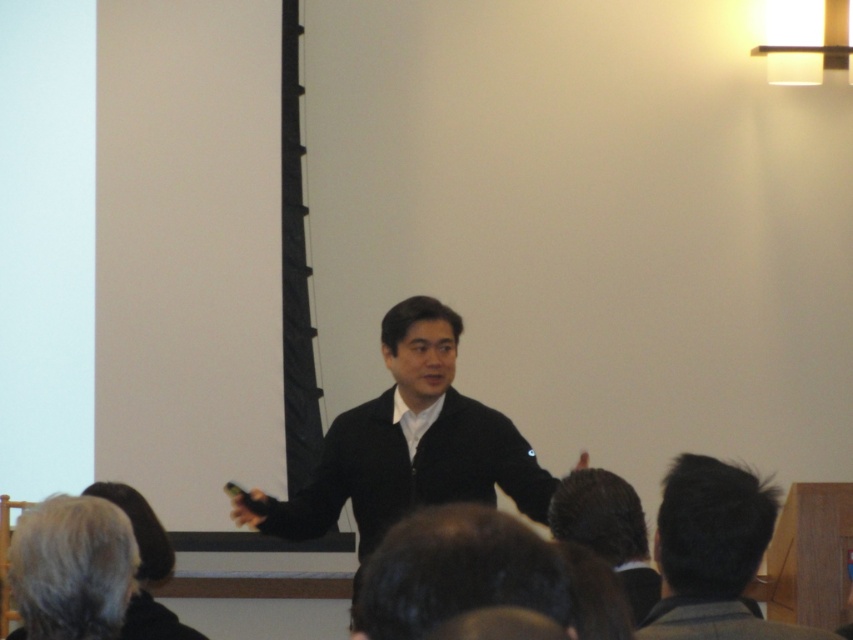
Question: Does black matte sweater at center appear over dark brown hair at lower right?

Choices:
 (A) yes
 (B) no

Answer: (A)

Question: Which point is farther from the camera taking this photo?

Choices:
 (A) (473, 438)
 (B) (114, 579)
 (C) (726, 488)

Answer: (A)

Question: Which point is closer to the camera?

Choices:
 (A) gray hair at lower left
 (B) black matte sweater at center

Answer: (A)

Question: Does black matte sweater at center have a greater width compared to dark brown hair at lower right?

Choices:
 (A) yes
 (B) no

Answer: (A)

Question: Does dark brown hair at lower right appear over gray hair at lower left?

Choices:
 (A) yes
 (B) no

Answer: (A)

Question: Which object is positioned farthest from the dark brown hair at lower right?

Choices:
 (A) black matte sweater at center
 (B) gray hair at lower left

Answer: (A)